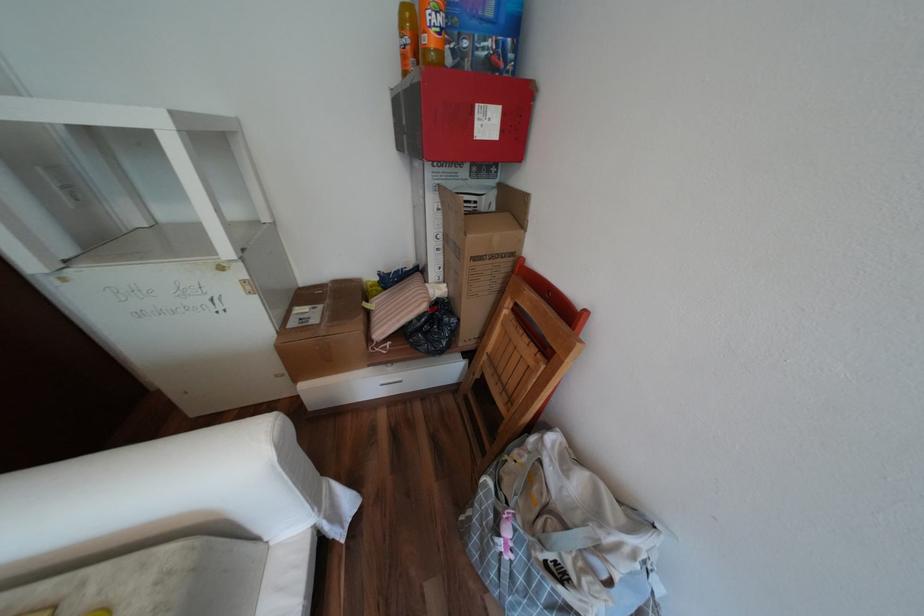
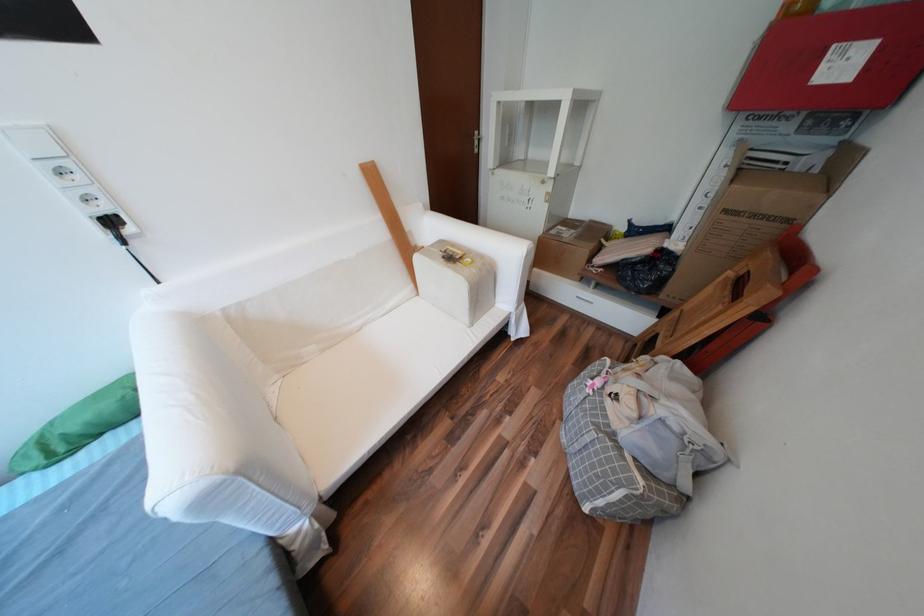
The point at (482, 257) is marked in the first image. Where is the corresponding point in the second image?

(736, 211)